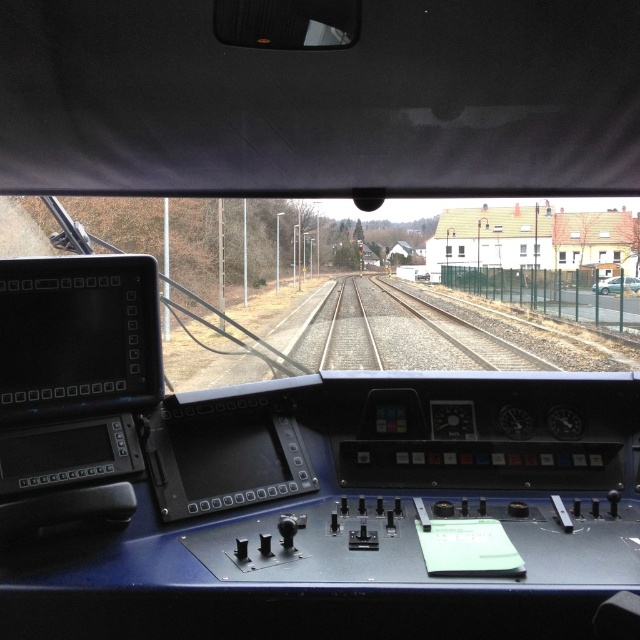
Who is higher up, smooth metal train track at center or metallic silver car at right?

Positioned higher is metallic silver car at right.

The height and width of the screenshot is (640, 640). What do you see at coordinates (401, 333) in the screenshot?
I see `smooth metal train track at center` at bounding box center [401, 333].

Identify the location of smooth metal train track at center. click(x=401, y=333).